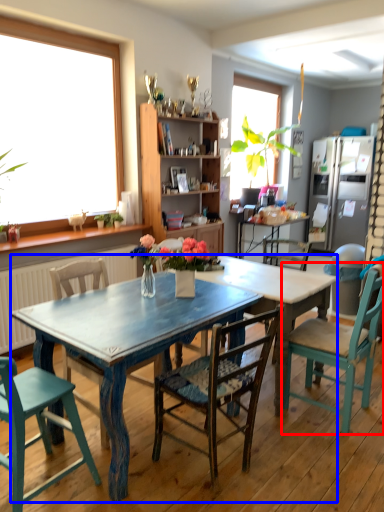
Question: Which object appears farthest to the camera in this image, chair (highlighted by a red box) or desk (highlighted by a blue box)?

Choices:
 (A) chair
 (B) desk

Answer: (A)